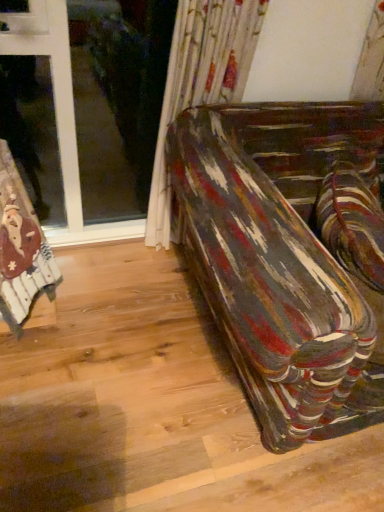
Describe the element at coordinates (21, 249) in the screenshot. I see `white fabric tablecloth at left` at that location.

Locate an element on the screen. This screenshot has height=512, width=384. white fabric tablecloth at left is located at coordinates (21, 249).

Identify the location of white fabric tablecloth at left. (21, 249).